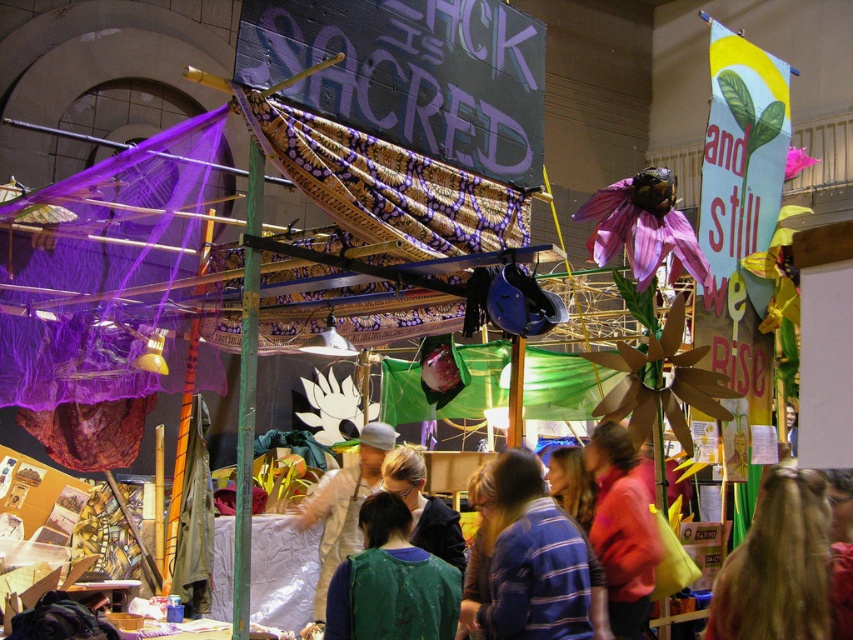
Question: Is green fabric at center wider than pink fabric at center?

Choices:
 (A) yes
 (B) no

Answer: (A)

Question: Can you confirm if blonde hair at center is positioned below green fabric at center?

Choices:
 (A) no
 (B) yes

Answer: (A)

Question: In this image, where is blonde hair at center located relative to light brown fabric at center?

Choices:
 (A) below
 (B) above

Answer: (B)

Question: Which of the following is the closest to the observer?

Choices:
 (A) striped cotton shirt at center
 (B) light brown fabric at center
 (C) blonde hair at center
 (D) pink fabric at center

Answer: (C)

Question: Which point is closer to the camera?

Choices:
 (A) striped cotton shirt at center
 (B) pink fabric at center
 (C) light brown fabric at center

Answer: (A)

Question: Which of the following is the closest to the observer?

Choices:
 (A) pink fabric at center
 (B) green fabric at center
 (C) blonde hair at center
 (D) striped cotton shirt at center

Answer: (C)